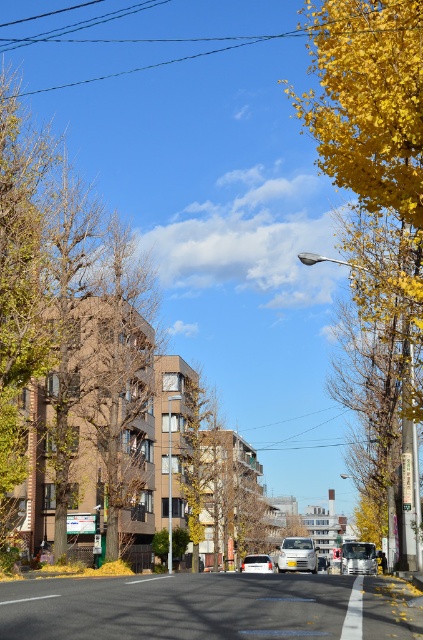
Based on the photo, you are a pedestrian standing at the crosswalk and see both the matte silver van at center and the metallic silver van at center. Which van is closer to the ground?

The matte silver van at center is located below the metallic silver van at center, so it is closer to the ground.

You are standing at the intersection and want to take a photo of the matte silver van at center. What are the coordinates where you should aim your camera?

The matte silver van at center is located at coordinates point (296,554).